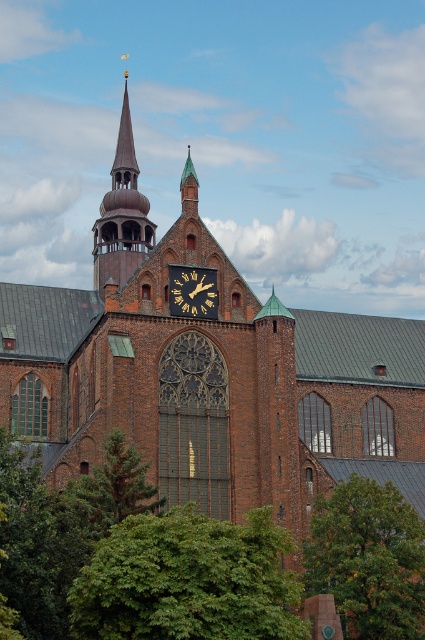
Question: Is green leafy tree at lower right thinner than green needle-like tree at center-left?

Choices:
 (A) no
 (B) yes

Answer: (A)

Question: Which is farther from the green leafy tree at lower right?

Choices:
 (A) brown wooden bell tower at upper center
 (B) green leafy tree at lower left
 (C) green needle-like tree at center-left
 (D) gold metallic clock at center

Answer: (A)

Question: Which object is positioned farthest from the brown wooden bell tower at upper center?

Choices:
 (A) green leafy tree at lower right
 (B) green needle-like tree at center-left

Answer: (B)

Question: Which point is farther to the camera?

Choices:
 (A) (173, 300)
 (B) (96, 289)
 (C) (144, 472)

Answer: (B)

Question: Can you confirm if green leafy tree at lower right is positioned to the left of gold metallic clock at center?

Choices:
 (A) no
 (B) yes

Answer: (A)

Question: Is brown wooden bell tower at upper center below gold metallic clock at center?

Choices:
 (A) yes
 (B) no

Answer: (B)